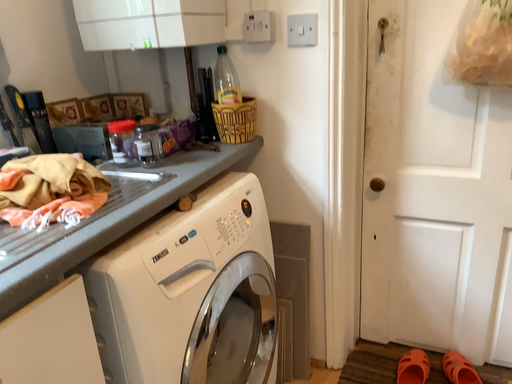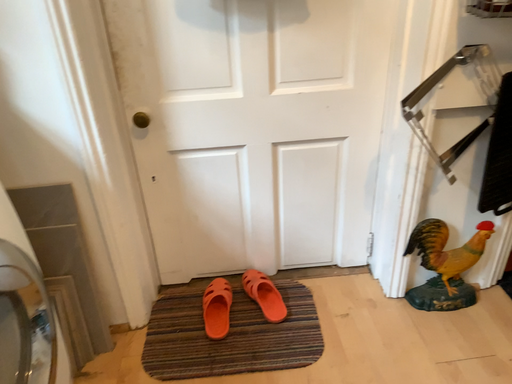
Question: How did the camera likely rotate when shooting the video?

Choices:
 (A) rotated upward
 (B) rotated downward

Answer: (B)